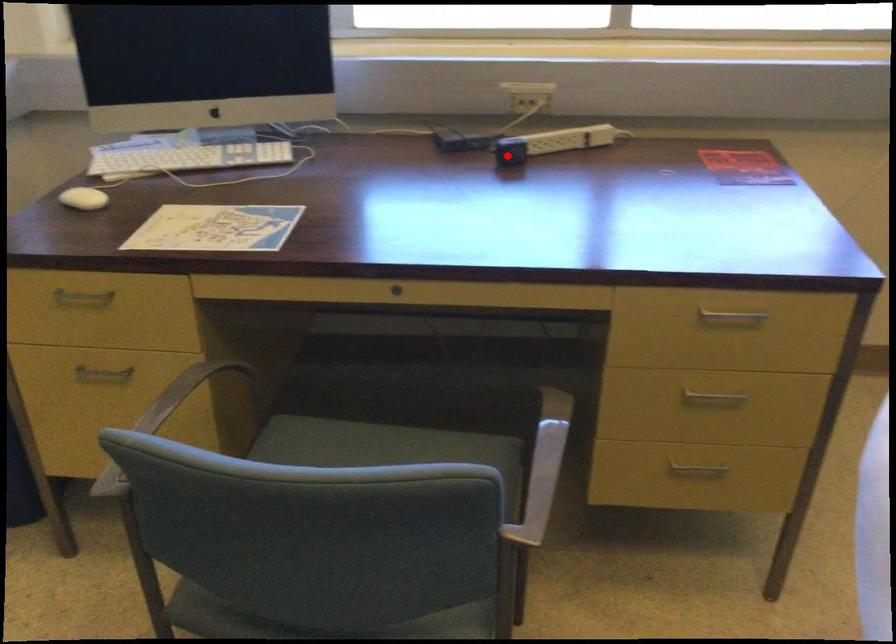
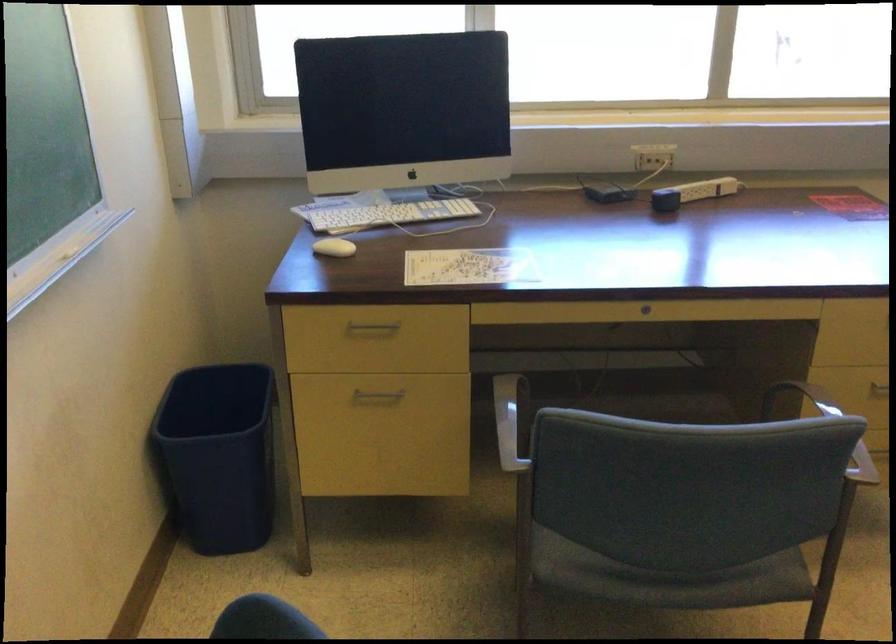
Question: I am providing you with two images of the same scene from different viewpoints. Image1 has a red point marked. In image2, the corresponding 3D location appears at what relative position? Reply with the corresponding letter.

Choices:
 (A) Closer
 (B) Farther

Answer: (B)